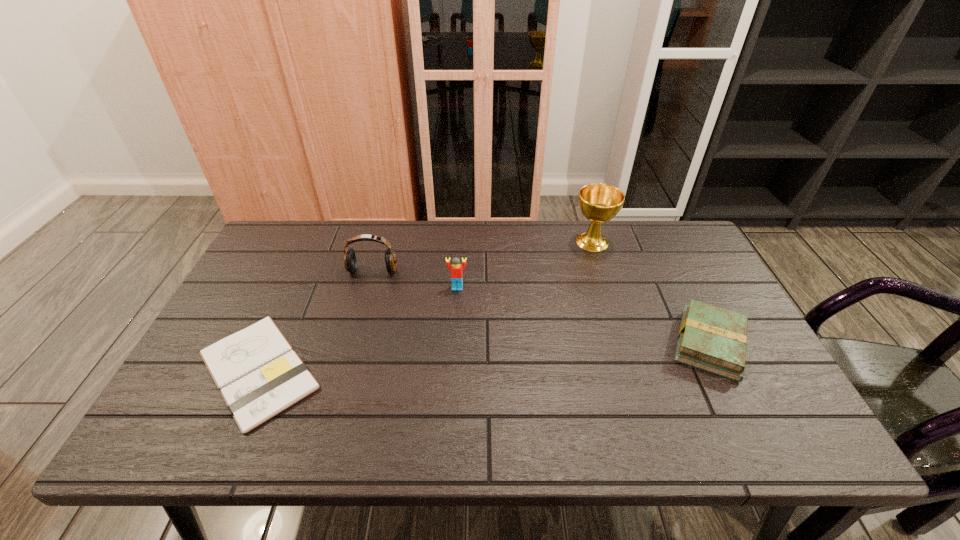
The image size is (960, 540). Identify the location of empty space between the shortest object and the rightmost object. (484, 357).

Find the location of a particular element. The width and height of the screenshot is (960, 540). vacant area that lies between the notepad and the third farthest object is located at coordinates (358, 329).

Where is `unoccupied area between the fourth nearest object and the tallest object`? The height and width of the screenshot is (540, 960). unoccupied area between the fourth nearest object and the tallest object is located at coordinates (483, 256).

Locate an element on the screen. The height and width of the screenshot is (540, 960). vacant space that is in between the notepad and the third nearest object is located at coordinates (358, 329).

Find the location of a particular element. Image resolution: width=960 pixels, height=540 pixels. empty location between the shortest object and the third tallest object is located at coordinates (358, 329).

The height and width of the screenshot is (540, 960). I want to click on vacant space that is in between the chalice and the book, so click(651, 293).

This screenshot has height=540, width=960. Find the location of `the second closest object to the tallest object`. the second closest object to the tallest object is located at coordinates (456, 268).

Locate which object is the third closest to the second farthest object. Please provide its 2D coordinates. Your answer should be formatted as a tuple, i.e. [(x, y)], where the tuple contains the x and y coordinates of a point satisfying the conditions above.

[(599, 203)]

Identify the location of vacant space that satisfies the following two spatial constraints: 1. on the face of the book; 2. on the right side of the third farthest object. (454, 344).